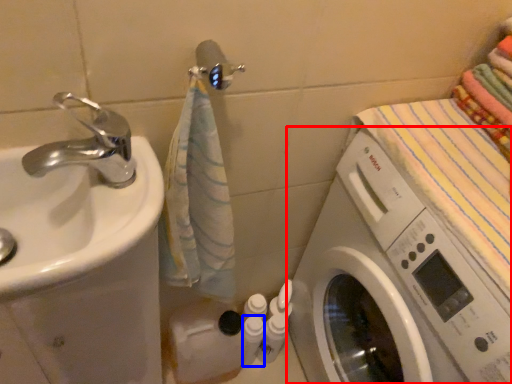
Question: Which point is further to the camera, washing machine (highlighted by a red box) or toiletry (highlighted by a blue box)?

Choices:
 (A) washing machine
 (B) toiletry

Answer: (B)